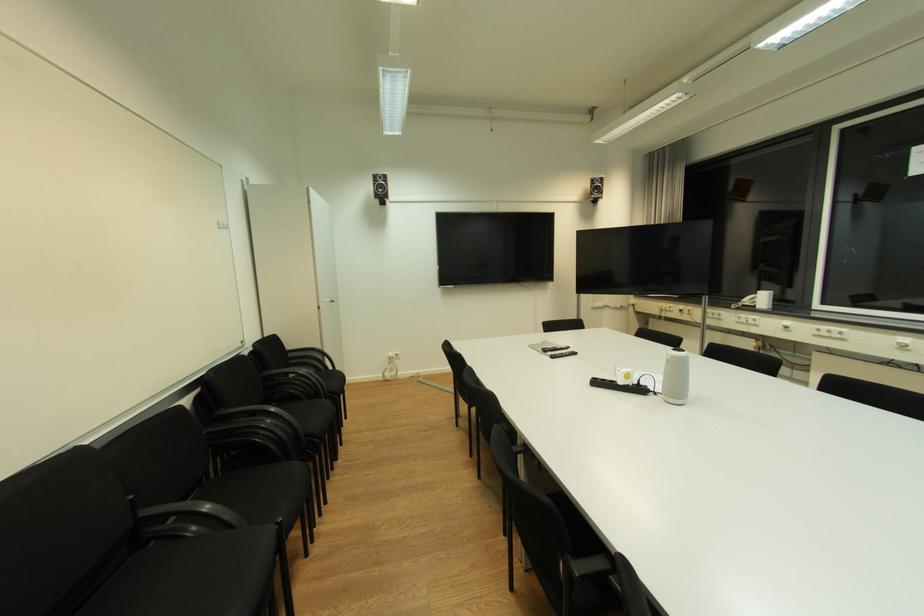
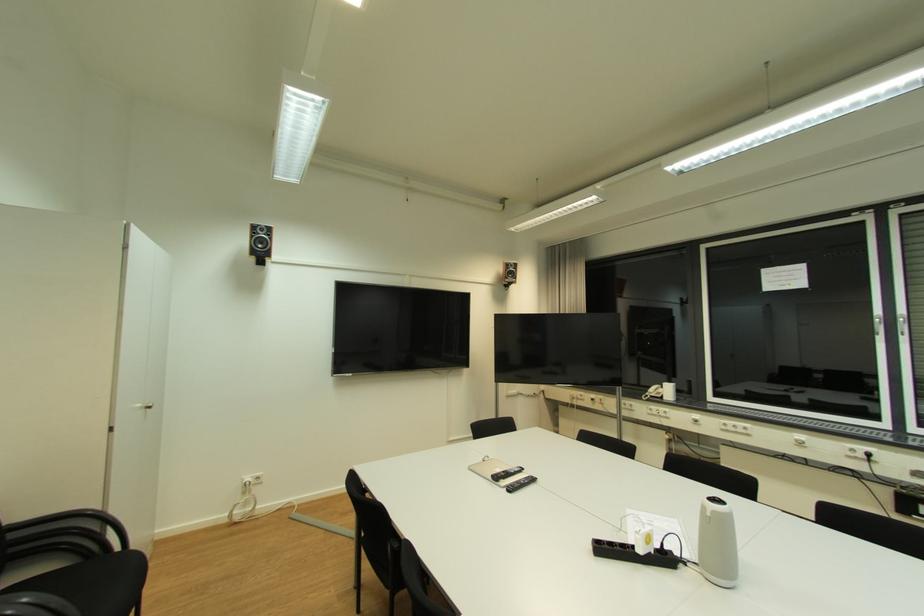
The point at (749, 306) is marked in the first image. Where is the corresponding point in the second image?

(657, 397)